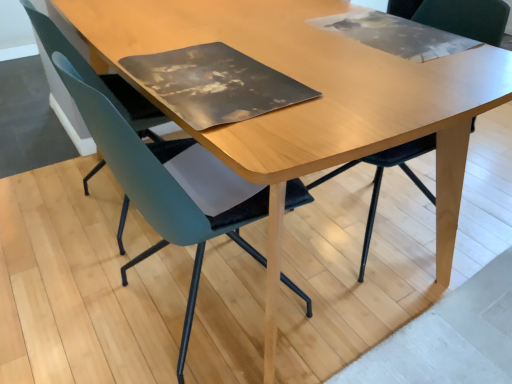
Where is `light wood table at center`? light wood table at center is located at coordinates (315, 89).

What do you see at coordinates (315, 89) in the screenshot?
I see `light wood table at center` at bounding box center [315, 89].

What do you see at coordinates (108, 86) in the screenshot? The image size is (512, 384). I see `teal matte chair at left, the 1th chair in the left-to-right sequence` at bounding box center [108, 86].

Identify the location of teal fabric chair at center, arranged as the second chair when viewed from the right. This screenshot has width=512, height=384. (157, 186).

Which object is thinner, light wood table at center or teal matte chair at left, the third chair viewed from the right?

Thinner between the two is teal matte chair at left, the third chair viewed from the right.

Considering their positions, is light wood table at center located in front of or behind teal matte chair at left, the 1th chair in the left-to-right sequence?

In the image, light wood table at center appears in front of teal matte chair at left, the 1th chair in the left-to-right sequence.

Which of these two, light wood table at center or teal matte chair at left, the 1th chair in the left-to-right sequence, is smaller?

Smaller between the two is teal matte chair at left, the 1th chair in the left-to-right sequence.

From the image's perspective, is light wood table at center positioned above or below teal matte chair at left, the third chair viewed from the right?

light wood table at center is situated lower than teal matte chair at left, the third chair viewed from the right, in the image.

Which of these two, teal matte chair at left, the third chair viewed from the right, or light wood table at center, stands taller?

teal matte chair at left, the third chair viewed from the right, is taller.

Can you see teal matte chair at left, the third chair viewed from the right, touching light wood table at center?

teal matte chair at left, the third chair viewed from the right, and light wood table at center are clearly separated.

Is teal matte chair at left, the 1th chair in the left-to-right sequence, spatially inside light wood table at center, or outside of it?

teal matte chair at left, the 1th chair in the left-to-right sequence, is located inside light wood table at center.

Identify the location of chair located behind the matte black chair at center, the first chair positioned from the right. Image resolution: width=512 pixels, height=384 pixels. (108, 86).

From a real-world perspective, relative to teal matte chair at left, the 1th chair in the left-to-right sequence, is matte black chair at center, the first chair positioned from the right, vertically above or below?

Clearly, from a real-world perspective, matte black chair at center, the first chair positioned from the right, is above teal matte chair at left, the 1th chair in the left-to-right sequence.

Is teal matte chair at left, the third chair viewed from the right, completely or partially inside matte black chair at center, the 3th chair in the left-to-right sequence?

No, teal matte chair at left, the third chair viewed from the right, is not a part of matte black chair at center, the 3th chair in the left-to-right sequence.

In the scene shown: Considering the relative positions of matte black chair at center, the first chair positioned from the right, and teal matte chair at left, the third chair viewed from the right, in the image provided, is matte black chair at center, the first chair positioned from the right, behind teal matte chair at left, the third chair viewed from the right,?

No, it is in front of teal matte chair at left, the third chair viewed from the right.

Are matte black chair at center, the 3th chair in the left-to-right sequence, and light wood table at center making contact?

No, matte black chair at center, the 3th chair in the left-to-right sequence, is not touching light wood table at center.

From the picture: Could you measure the distance between matte black chair at center, the first chair positioned from the right, and light wood table at center?

A distance of 19.24 inches exists between matte black chair at center, the first chair positioned from the right, and light wood table at center.

In the scene shown: Does matte black chair at center, the 3th chair in the left-to-right sequence, have a lesser width compared to light wood table at center?

Yes, matte black chair at center, the 3th chair in the left-to-right sequence, is thinner than light wood table at center.

From the image's perspective, would you say matte black chair at center, the 3th chair in the left-to-right sequence, is positioned over light wood table at center?

No, from the image's perspective, matte black chair at center, the 3th chair in the left-to-right sequence, is not above light wood table at center.

Measure the distance from teal fabric chair at center, the second chair in the left-to-right sequence, to light wood table at center.

teal fabric chair at center, the second chair in the left-to-right sequence, and light wood table at center are 11.90 inches apart.

Is light wood table at center at the back of teal fabric chair at center, arranged as the second chair when viewed from the right?

Correct, teal fabric chair at center, arranged as the second chair when viewed from the right, is looking away from light wood table at center.

From the image's perspective, which is above, teal fabric chair at center, arranged as the second chair when viewed from the right, or light wood table at center?

From the image's view, light wood table at center is above.

In terms of height, does teal fabric chair at center, arranged as the second chair when viewed from the right, look taller or shorter compared to light wood table at center?

Considering their sizes, teal fabric chair at center, arranged as the second chair when viewed from the right, has more height than light wood table at center.

Based on the photo, how different are the orientations of light wood table at center and teal fabric chair at center, arranged as the second chair when viewed from the right, in degrees?

The angle between the facing direction of light wood table at center and the facing direction of teal fabric chair at center, arranged as the second chair when viewed from the right, is 1.72 degrees.

Is point (118, 8) closer to viewer compared to point (288, 206)?

No, (118, 8) is further to viewer.

Visually, is light wood table at center positioned to the left or to the right of teal fabric chair at center, the second chair in the left-to-right sequence?

In the image, light wood table at center appears on the right side of teal fabric chair at center, the second chair in the left-to-right sequence.

From the image's perspective, relative to teal fabric chair at center, arranged as the second chair when viewed from the right, is light wood table at center above or below?

light wood table at center is above teal fabric chair at center, arranged as the second chair when viewed from the right.

Considering the relative sizes of teal fabric chair at center, arranged as the second chair when viewed from the right, and matte black chair at center, the first chair positioned from the right, in the image provided, is teal fabric chair at center, arranged as the second chair when viewed from the right, thinner than matte black chair at center, the first chair positioned from the right,?

Incorrect, the width of teal fabric chair at center, arranged as the second chair when viewed from the right, is not less than that of matte black chair at center, the first chair positioned from the right.

Is teal fabric chair at center, the second chair in the left-to-right sequence, oriented away from matte black chair at center, the first chair positioned from the right?

No, teal fabric chair at center, the second chair in the left-to-right sequence,'s orientation is not away from matte black chair at center, the first chair positioned from the right.

Can you tell me how much teal fabric chair at center, arranged as the second chair when viewed from the right, and matte black chair at center, the 3th chair in the left-to-right sequence, differ in facing direction?

The angle between the facing direction of teal fabric chair at center, arranged as the second chair when viewed from the right, and the facing direction of matte black chair at center, the 3th chair in the left-to-right sequence, is 175 degrees.

From the image's perspective, is teal fabric chair at center, the second chair in the left-to-right sequence, beneath matte black chair at center, the 3th chair in the left-to-right sequence?

Yes, from the image's perspective, teal fabric chair at center, the second chair in the left-to-right sequence, is beneath matte black chair at center, the 3th chair in the left-to-right sequence.

At what (x,y) coordinates should I click in order to perform the action: click on table that is in front of the teal matte chair at left, the third chair viewed from the right. Please return your answer as a coordinate pair (x, y). Looking at the image, I should click on coord(315,89).

In order to click on table below the teal matte chair at left, the third chair viewed from the right (from the image's perspective) in this screenshot , I will do `click(315, 89)`.

Which object lies nearer to the anchor point teal fabric chair at center, arranged as the second chair when viewed from the right, teal matte chair at left, the 1th chair in the left-to-right sequence, or matte black chair at center, the 3th chair in the left-to-right sequence?

The object closer to teal fabric chair at center, arranged as the second chair when viewed from the right, is teal matte chair at left, the 1th chair in the left-to-right sequence.

Estimate the real-world distances between objects in this image. Which object is closer to teal fabric chair at center, the second chair in the left-to-right sequence, light wood table at center or teal matte chair at left, the third chair viewed from the right?

Based on the image, teal matte chair at left, the third chair viewed from the right, appears to be nearer to teal fabric chair at center, the second chair in the left-to-right sequence.

Considering their positions, is teal matte chair at left, the third chair viewed from the right, positioned closer to light wood table at center than teal fabric chair at center, the second chair in the left-to-right sequence?

teal fabric chair at center, the second chair in the left-to-right sequence.

Considering their positions, is teal fabric chair at center, arranged as the second chair when viewed from the right, positioned further to teal matte chair at left, the 1th chair in the left-to-right sequence, than light wood table at center?

Among the two, light wood table at center is located further to teal matte chair at left, the 1th chair in the left-to-right sequence.

Based on their spatial positions, is matte black chair at center, the 3th chair in the left-to-right sequence, or teal fabric chair at center, arranged as the second chair when viewed from the right, further from teal matte chair at left, the third chair viewed from the right?

Based on the image, matte black chair at center, the 3th chair in the left-to-right sequence, appears to be further to teal matte chair at left, the third chair viewed from the right.

Looking at the image, which one is located further to matte black chair at center, the first chair positioned from the right, light wood table at center or teal fabric chair at center, the second chair in the left-to-right sequence?

teal fabric chair at center, the second chair in the left-to-right sequence, is positioned further to the anchor matte black chair at center, the first chair positioned from the right.

From the image, which object appears to be farther from matte black chair at center, the 3th chair in the left-to-right sequence, teal matte chair at left, the 1th chair in the left-to-right sequence, or light wood table at center?

teal matte chair at left, the 1th chair in the left-to-right sequence, is further to matte black chair at center, the 3th chair in the left-to-right sequence.

When comparing their distances from teal fabric chair at center, the second chair in the left-to-right sequence, does matte black chair at center, the first chair positioned from the right, or light wood table at center seem further?

matte black chair at center, the first chair positioned from the right, lies further to teal fabric chair at center, the second chair in the left-to-right sequence, than the other object.

At what (x,y) coordinates should I click in order to perform the action: click on table between teal fabric chair at center, the second chair in the left-to-right sequence, and matte black chair at center, the first chair positioned from the right, in the horizontal direction. Please return your answer as a coordinate pair (x, y). Looking at the image, I should click on (315, 89).

I want to click on table situated between teal matte chair at left, the 1th chair in the left-to-right sequence, and matte black chair at center, the first chair positioned from the right, from left to right, so click(x=315, y=89).

You are a GUI agent. You are given a task and a screenshot of the screen. Output one action in this format:
    pyautogui.click(x=<x>, y=<y>)
    Task: Click on the chair between teal matte chair at left, the third chair viewed from the right, and matte black chair at center, the first chair positioned from the right, from left to right
    The width and height of the screenshot is (512, 384).
    Given the screenshot: What is the action you would take?
    pyautogui.click(x=157, y=186)